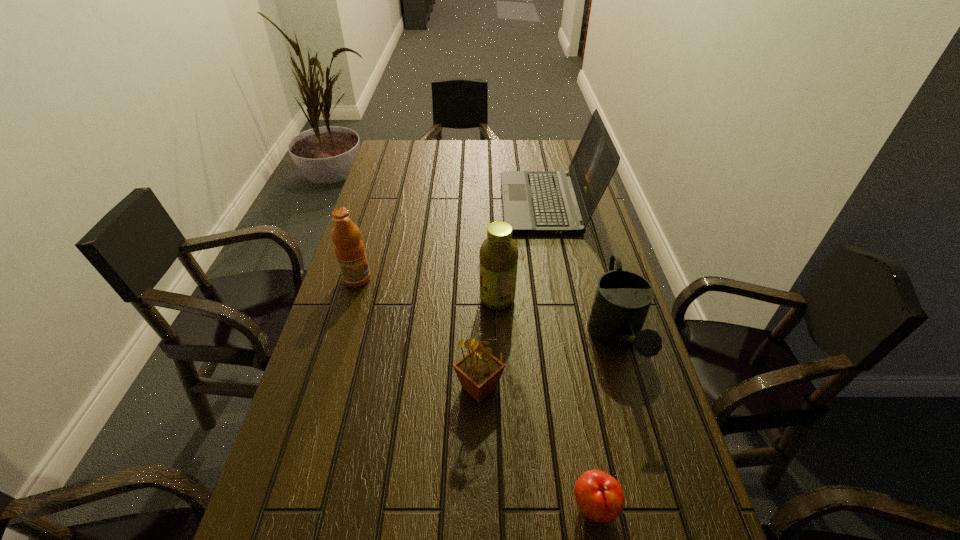
Where is `vacant area that satisfies the following two spatial constraints: 1. on the front label of the right fruit juice; 2. at the front of the sunflower with flowers visible`? Image resolution: width=960 pixels, height=540 pixels. vacant area that satisfies the following two spatial constraints: 1. on the front label of the right fruit juice; 2. at the front of the sunflower with flowers visible is located at coordinates (501, 387).